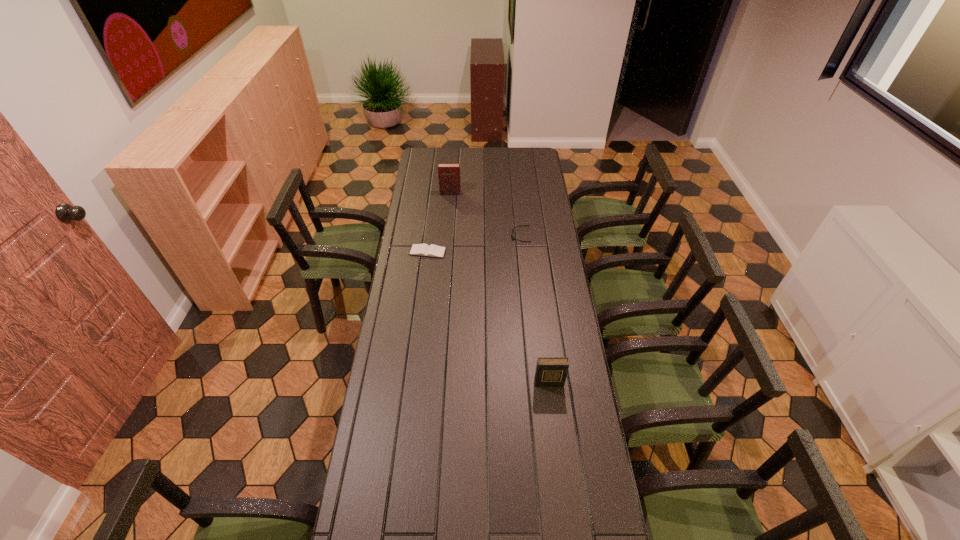
What are the coordinates of `free spot between the sunglasses and the second tallest diary` in the screenshot? It's located at (535, 309).

This screenshot has height=540, width=960. Find the location of `unoccupied position between the shortest diary and the second shortest diary`. unoccupied position between the shortest diary and the second shortest diary is located at coordinates (488, 318).

Find the location of a particular element. Image resolution: width=960 pixels, height=540 pixels. free spot between the second farthest object and the farthest diary is located at coordinates (486, 214).

Locate an element on the screen. This screenshot has height=540, width=960. vacant region between the second farthest object and the shortest diary is located at coordinates (474, 244).

Find the location of `free space between the second tallest object and the second farthest object`. free space between the second tallest object and the second farthest object is located at coordinates tap(535, 309).

The width and height of the screenshot is (960, 540). What are the coordinates of `vacant area between the nearest object and the third nearest object` in the screenshot? It's located at (535, 309).

The height and width of the screenshot is (540, 960). What are the coordinates of `free space between the farthest object and the second tallest object` in the screenshot? It's located at pos(499,288).

Find the location of `free space between the third nearest object and the nearest object`. free space between the third nearest object and the nearest object is located at coordinates (535, 309).

This screenshot has height=540, width=960. I want to click on vacant space in between the third nearest object and the second nearest diary, so click(x=474, y=244).

Where is `vacant area between the shortest diary and the nearest object`? vacant area between the shortest diary and the nearest object is located at coordinates (488, 318).